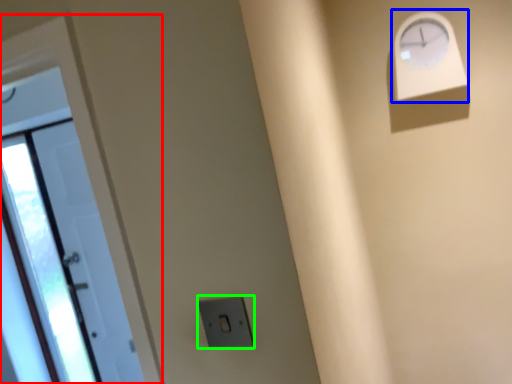
Question: Based on their relative distances, which object is farther from door (highlighted by a red box)? Choose from clock (highlighted by a blue box) and electric outlet (highlighted by a green box).

Choices:
 (A) clock
 (B) electric outlet

Answer: (A)